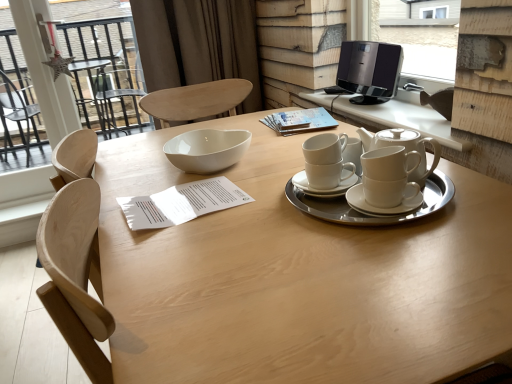
Where is `vacant region under black glossy speaker at upper right (from a real-world perspective)`? The width and height of the screenshot is (512, 384). vacant region under black glossy speaker at upper right (from a real-world perspective) is located at coordinates (364, 100).